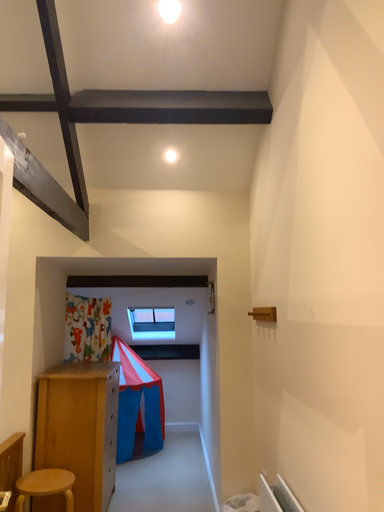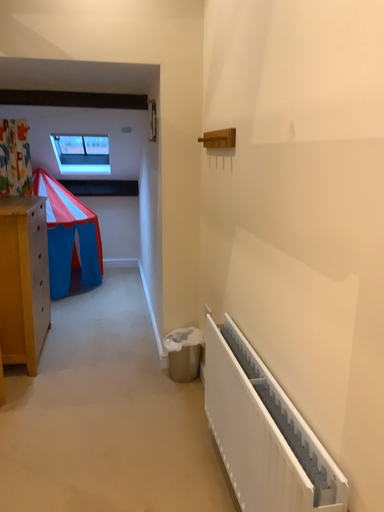
Question: How did the camera likely rotate when shooting the video?

Choices:
 (A) rotated left
 (B) rotated right

Answer: (B)